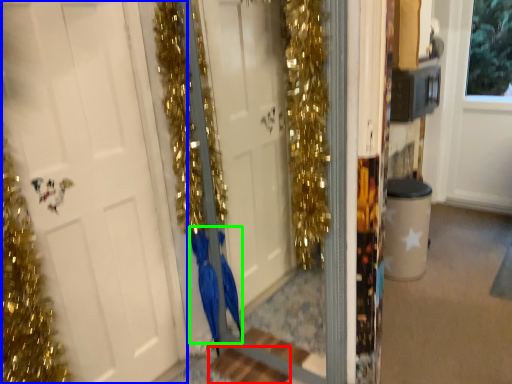
Question: Which is farther away from stair (highlighted by a red box)? door (highlighted by a blue box) or dress (highlighted by a green box)?

Choices:
 (A) door
 (B) dress

Answer: (A)